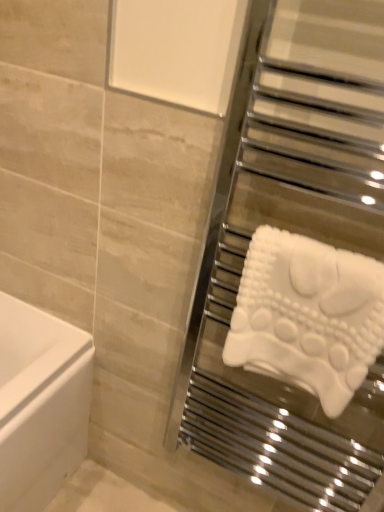
Image resolution: width=384 pixels, height=512 pixels. I want to click on white textured towel at right, so click(x=307, y=315).

The image size is (384, 512). What do you see at coordinates (307, 315) in the screenshot?
I see `white textured towel at right` at bounding box center [307, 315].

The image size is (384, 512). I want to click on white textured towel at right, so click(307, 315).